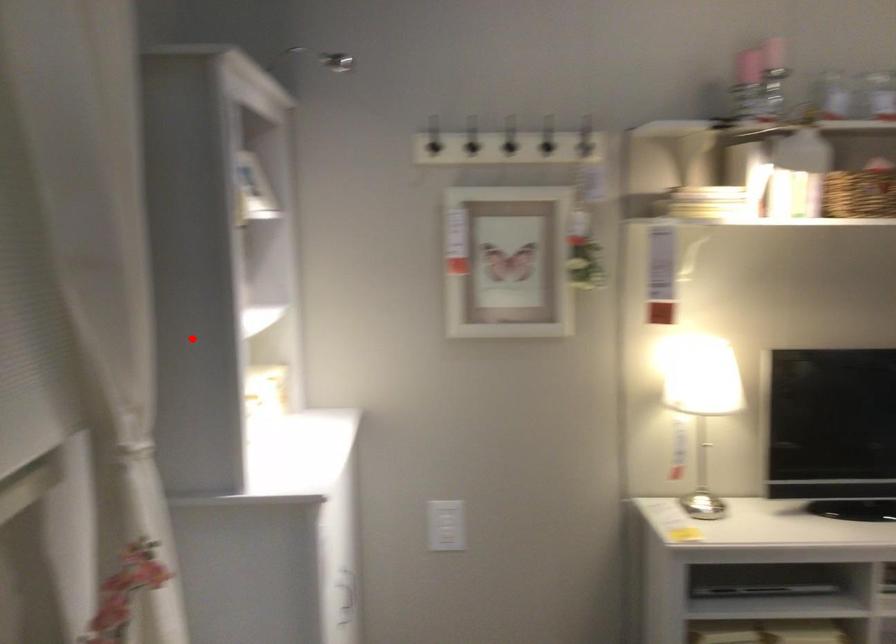
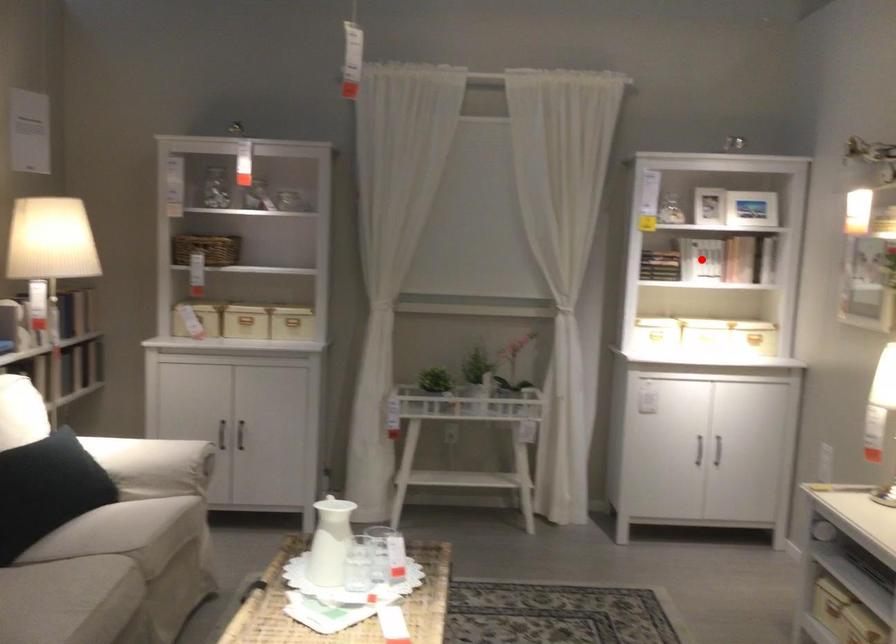
I am providing you with two images of the same scene from different viewpoints. A red point is marked on the first image and another point is marked on the second image. Is the red point in image1 aligned with the point shown in image2?

No